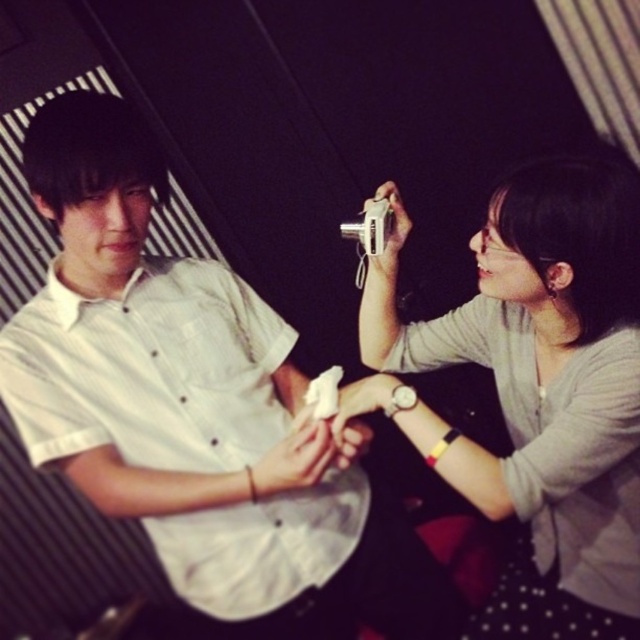
You are standing in the scene and want to take a photo of the seated person. The camera you are using has a focal length of 50mm. To ensure the entire white matte shirt at center is in frame, where should you position yourself relative to the point at coordinates (170, 381)?

You should position yourself directly at the point at coordinates (170, 381) since that point corresponds to the white matte shirt at center, ensuring it is centered in your viewfinder.

You are a photographer trying to capture a clear shot of the white matte shirt at center and the matte gray camera at upper right. Which object should you focus on first if you want to ensure both are in focus?

The white matte shirt at center is smaller than the matte gray camera at upper right. To ensure both are in focus, you should focus on the smaller object first, which is the white matte shirt at center, as it requires a closer attention to detail due to its size.